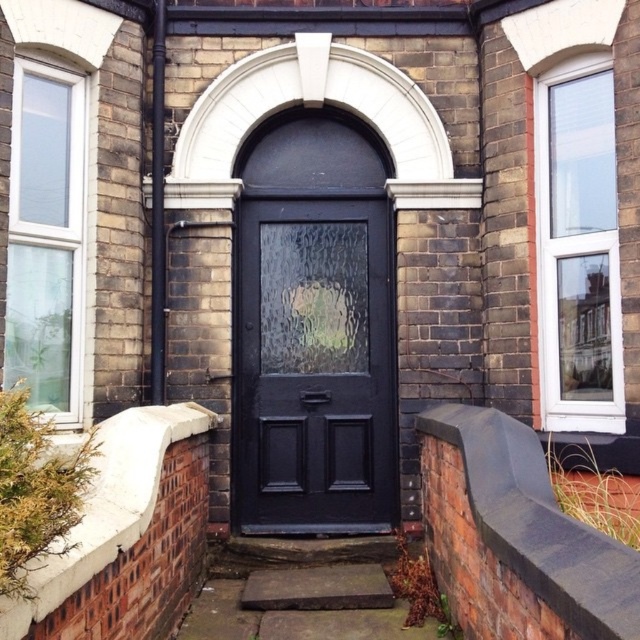
Between point (234, 388) and point (310, 573), which one is positioned in front?

Point (310, 573)

Does matte black door at center have a larger size compared to smooth concrete step at center?

Correct, matte black door at center is larger in size than smooth concrete step at center.

What are the coordinates of `matte black door at center` in the screenshot? It's located at (314, 365).

Where is `matte black door at center`? The width and height of the screenshot is (640, 640). matte black door at center is located at coordinates (314, 365).